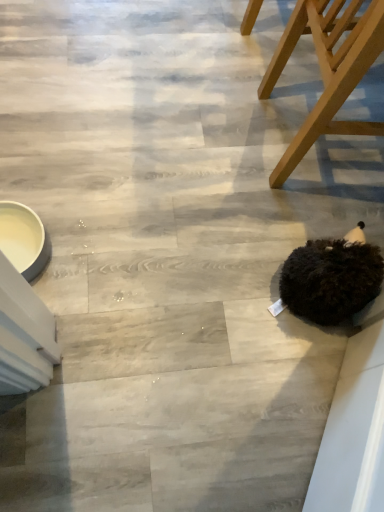
You are a GUI agent. You are given a task and a screenshot of the screen. Output one action in this format:
    pyautogui.click(x=<x>, y=<y>)
    Task: Click on the blank space to the left of wooden chair at upper right
    The height and width of the screenshot is (512, 384).
    Given the screenshot: What is the action you would take?
    pyautogui.click(x=211, y=112)